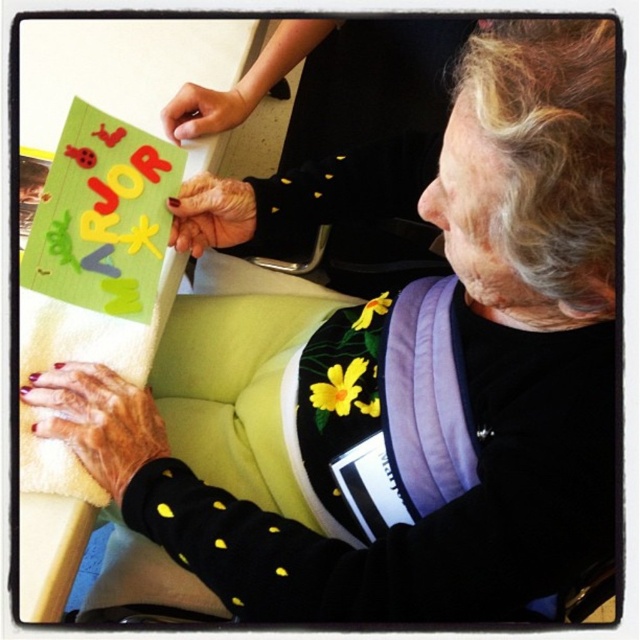
What are the coordinates of the nail polish painted fingernails at lower left?

The nail polish painted fingernails at lower left is located at point (97, 420).

You are a photographer adjusting your camera settings to capture the details of the scene. You notice the nail polish painted fingernails at lower left and the smooth skin hand at center in your viewfinder. Which object appears larger in your camera frame?

The nail polish painted fingernails at lower left appears much taller than the smooth skin hand at center in the camera frame.